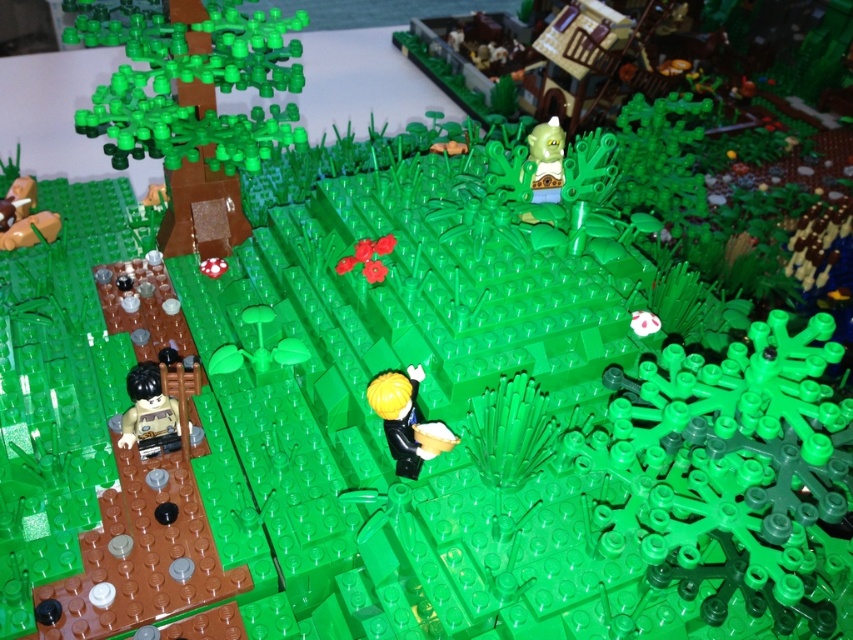
In the LEGO diorama, where is the smooth green tree at upper left located in terms of coordinates?

The smooth green tree at upper left is located at point coordinates of (199, 113).

You are a visitor looking at the LEGO diorama and want to touch both the brown matte minifigure at lower left and the black plastic minifigure at center. Which one can you reach first without moving your hand?

The brown matte minifigure at lower left is closer to you, so you can reach it first without moving your hand.